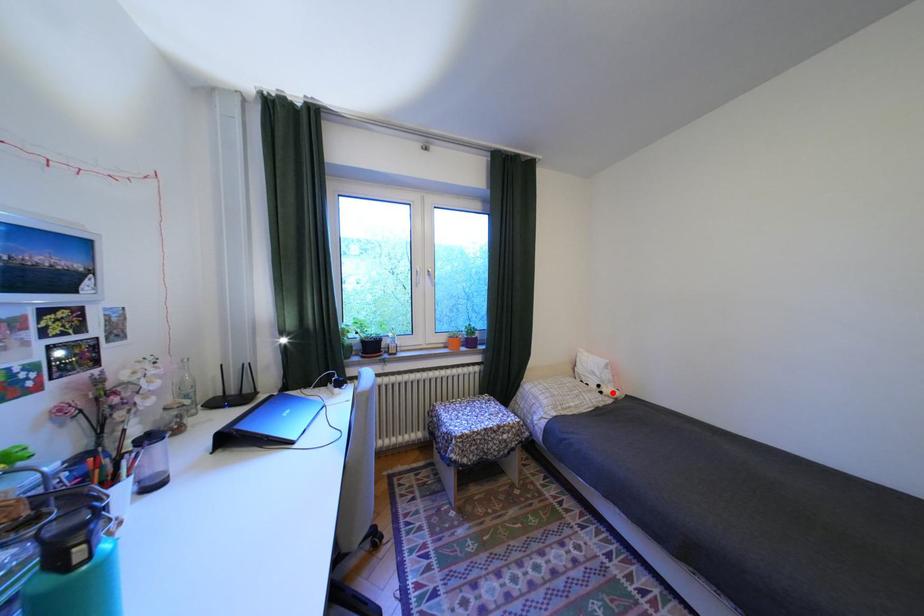
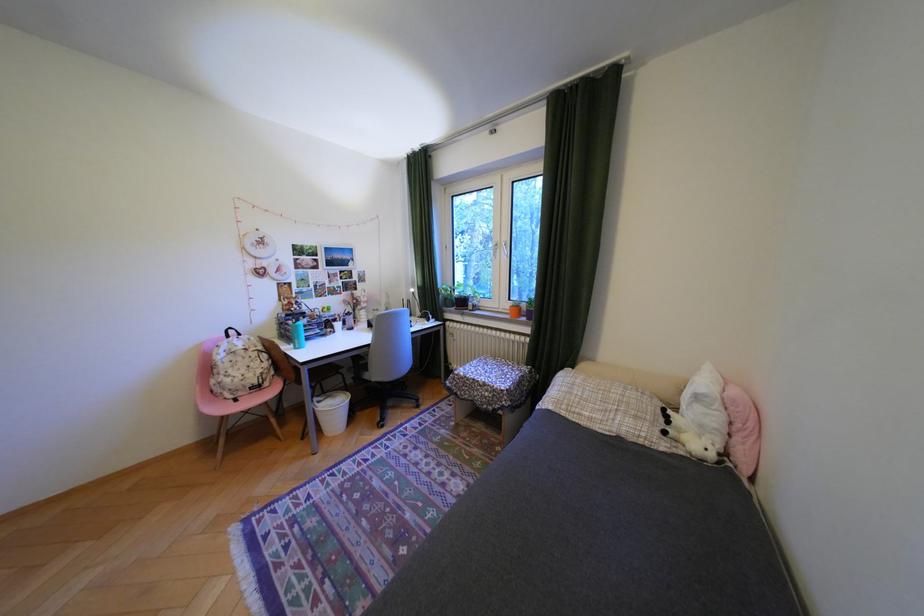
In the second image, find the point that corresponds to the highlighted location in the first image.

(676, 432)